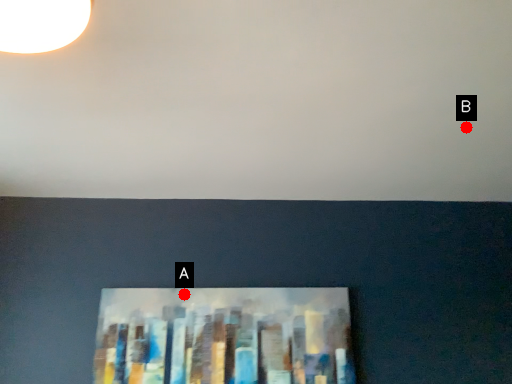
Question: Two points are circled on the image, labeled by A and B beside each circle. Which of the following is the farthest from the observer?

Choices:
 (A) A is further
 (B) B is further

Answer: (A)